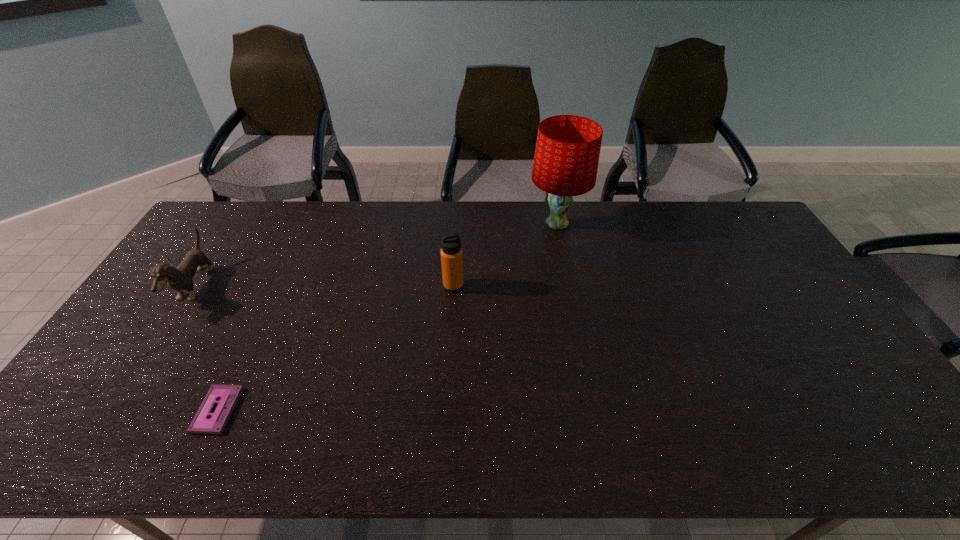
Image resolution: width=960 pixels, height=540 pixels. Find the location of `free space between the rightmost object and the second object from left to right`. free space between the rightmost object and the second object from left to right is located at coordinates [387, 317].

Select which object is the closest to the videotape. Please provide its 2D coordinates. Your answer should be formatted as a tuple, i.e. [(x, y)], where the tuple contains the x and y coordinates of a point satisfying the conditions above.

[(180, 278)]

You are a GUI agent. You are given a task and a screenshot of the screen. Output one action in this format:
    pyautogui.click(x=<x>, y=<y>)
    Task: Click on the third closest object to the puppy
    The height and width of the screenshot is (540, 960).
    Given the screenshot: What is the action you would take?
    pyautogui.click(x=567, y=151)

This screenshot has height=540, width=960. I want to click on free location that satisfies the following two spatial constraints: 1. on the front-facing side of the tallest object; 2. on the front side of the second object from right to left, so click(x=569, y=286).

Identify the location of free space that satisfies the following two spatial constraints: 1. on the back side of the nearest object; 2. at the face of the third tallest object. (275, 287).

Locate an element on the screen. vacant point that satisfies the following two spatial constraints: 1. on the front-facing side of the farthest object; 2. on the front side of the second object from right to left is located at coordinates (569, 286).